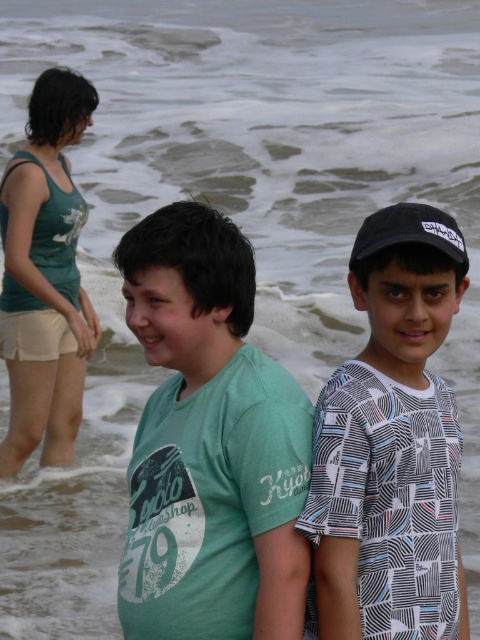
You are a photographer trying to capture the printed cotton shirt at center and the black matte baseball cap at upper right in your frame. Based on their positions, which object should you focus on first if you want to ensure both are in focus without moving the camera?

The printed cotton shirt at center is located below the black matte baseball cap at upper right, so focusing on the printed cotton shirt at center first would allow the black matte baseball cap at upper right to stay in focus as well since it is higher up in the frame.